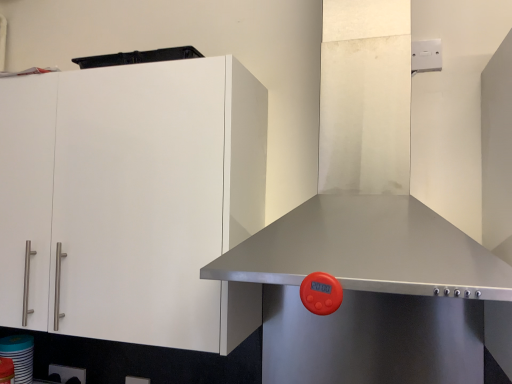
Question: From a real-world perspective, is stainless steel exhaust hood at center above or below white glossy cup at lower left?

Choices:
 (A) below
 (B) above

Answer: (B)

Question: Is stainless steel exhaust hood at center to the left or to the right of white glossy cup at lower left in the image?

Choices:
 (A) left
 (B) right

Answer: (B)

Question: Which object is the closest to the white matte cabinet at left?

Choices:
 (A) white glossy cup at lower left
 (B) stainless steel exhaust hood at center

Answer: (B)

Question: Which is farther from the stainless steel exhaust hood at center?

Choices:
 (A) white matte cabinet at left
 (B) white glossy cup at lower left

Answer: (B)